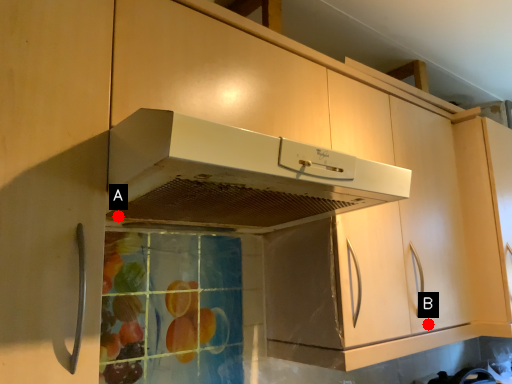
Question: Two points are circled on the image, labeled by A and B beside each circle. Among these points, which one is nearest to the camera?

Choices:
 (A) A is closer
 (B) B is closer

Answer: (A)